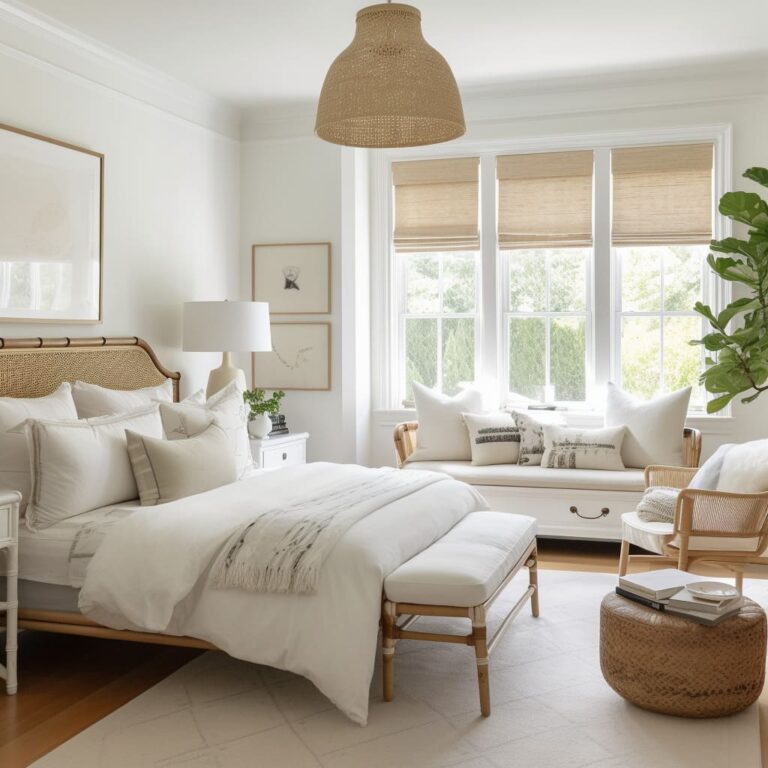
Where is `windows`? The width and height of the screenshot is (768, 768). windows is located at coordinates (630, 318), (555, 346), (432, 339).